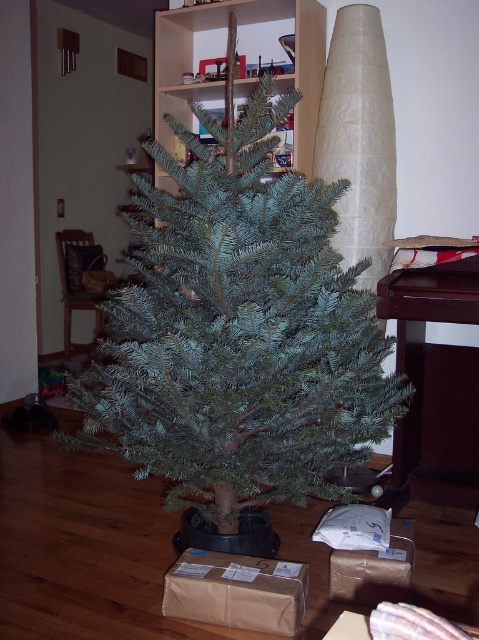
Question: Which point is closer to the camera?

Choices:
 (A) (373, 550)
 (B) (200, 234)

Answer: (B)

Question: Can you confirm if green matte christmas tree at center is positioned to the left of brown paper box at center?

Choices:
 (A) no
 (B) yes

Answer: (B)

Question: Does green matte christmas tree at center have a lesser width compared to brown paper box at center?

Choices:
 (A) no
 (B) yes

Answer: (A)

Question: Which object appears farthest from the camera in this image?

Choices:
 (A) green matte christmas tree at center
 (B) brown paper box at center
 (C) brown cardboard box at lower center

Answer: (C)

Question: Is green matte christmas tree at center positioned at the back of brown cardboard box at lower center?

Choices:
 (A) yes
 (B) no

Answer: (B)

Question: Which of the following is the closest to the observer?

Choices:
 (A) brown paper box at center
 (B) green matte christmas tree at center

Answer: (B)